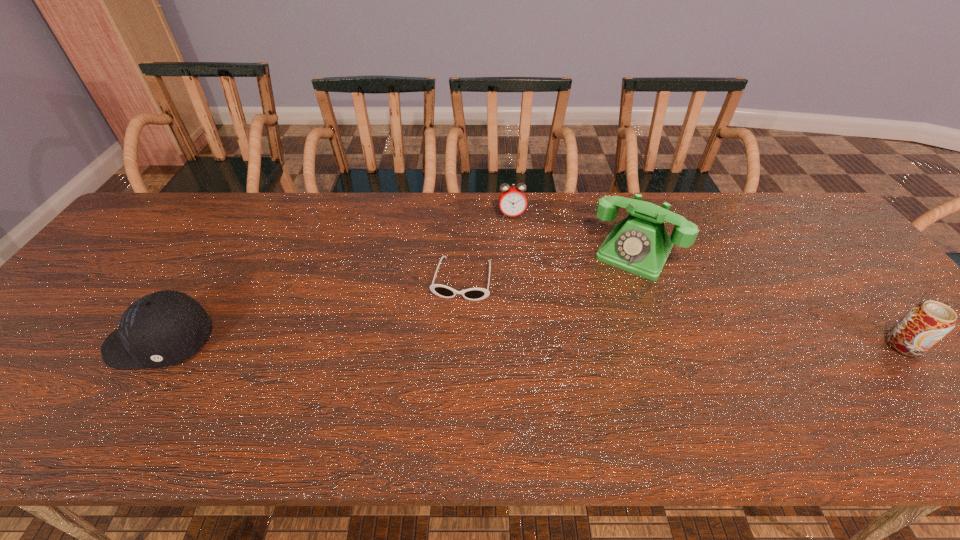
Image resolution: width=960 pixels, height=540 pixels. Find the location of `object that can be found as the closest to the sunglasses`. object that can be found as the closest to the sunglasses is located at coordinates (512, 200).

This screenshot has height=540, width=960. Find the location of `free space that satisfies the following two spatial constraints: 1. on the back side of the third object from right to left; 2. on the right side of the shortest object`. free space that satisfies the following two spatial constraints: 1. on the back side of the third object from right to left; 2. on the right side of the shortest object is located at coordinates (464, 215).

What are the coordinates of `vacant region that satisfies the following two spatial constraints: 1. on the front side of the rightmost object; 2. on the right side of the alarm clock` in the screenshot? It's located at (522, 345).